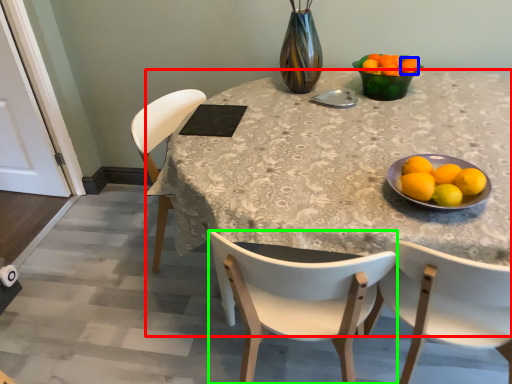
Question: Which is farther away from desk (highlighted by a red box)? tangerine (highlighted by a blue box) or chair (highlighted by a green box)?

Choices:
 (A) tangerine
 (B) chair

Answer: (A)